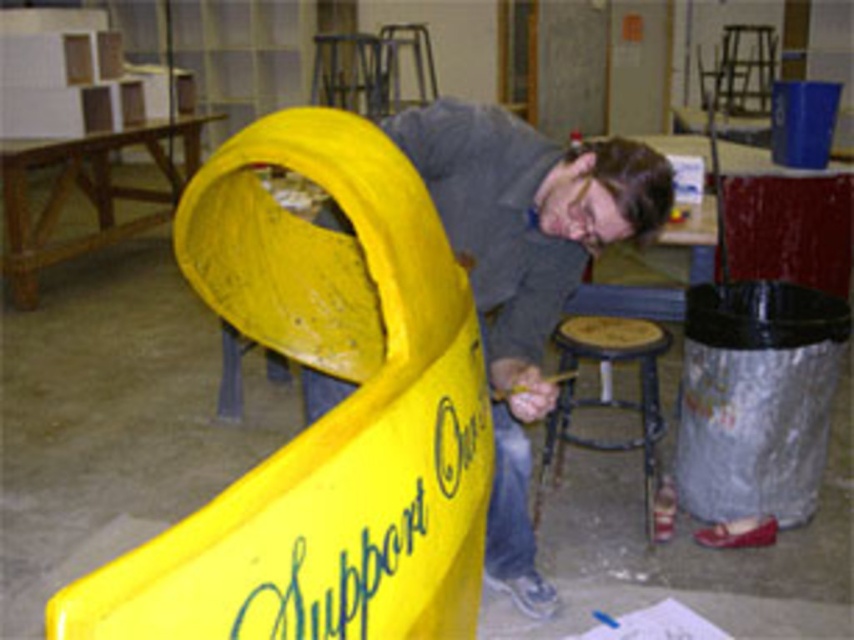
Question: From the image, what is the correct spatial relationship of yellow plastic slide at left in relation to wooden stool at lower center?

Choices:
 (A) right
 (B) left

Answer: (B)

Question: Is yellow plastic slide at left to the left of wooden stool at lower center from the viewer's perspective?

Choices:
 (A) yes
 (B) no

Answer: (A)

Question: Is matte yellow bucket at center below wooden stool at lower center?

Choices:
 (A) yes
 (B) no

Answer: (B)

Question: Based on their relative distances, which object is nearer to the matte yellow bucket at center?

Choices:
 (A) yellow plastic slide at left
 (B) wooden stool at lower center

Answer: (B)

Question: Which is farther from the matte yellow bucket at center?

Choices:
 (A) yellow plastic slide at left
 (B) wooden stool at lower center

Answer: (A)

Question: Among these points, which one is nearest to the camera?

Choices:
 (A) (469, 132)
 (B) (229, 500)
 (C) (651, 394)

Answer: (B)